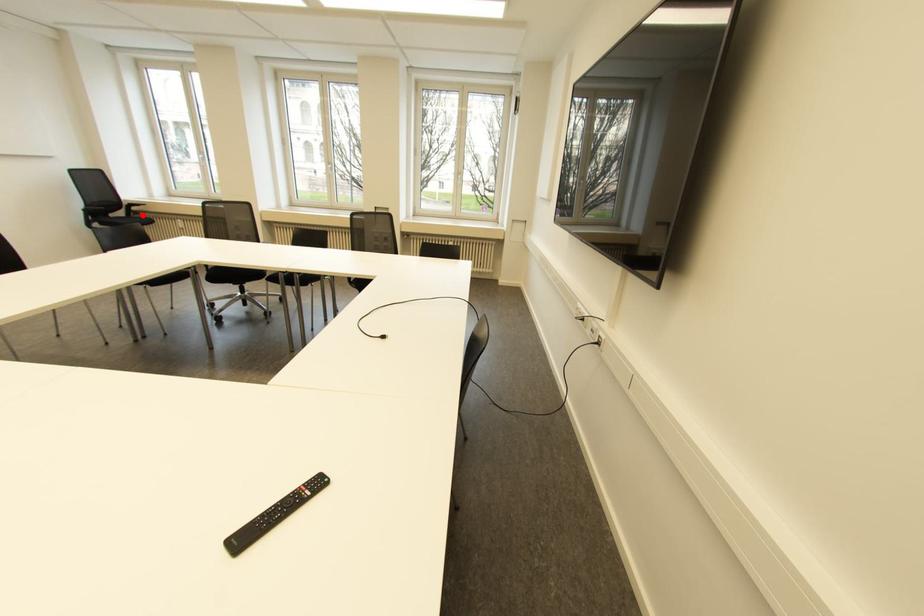
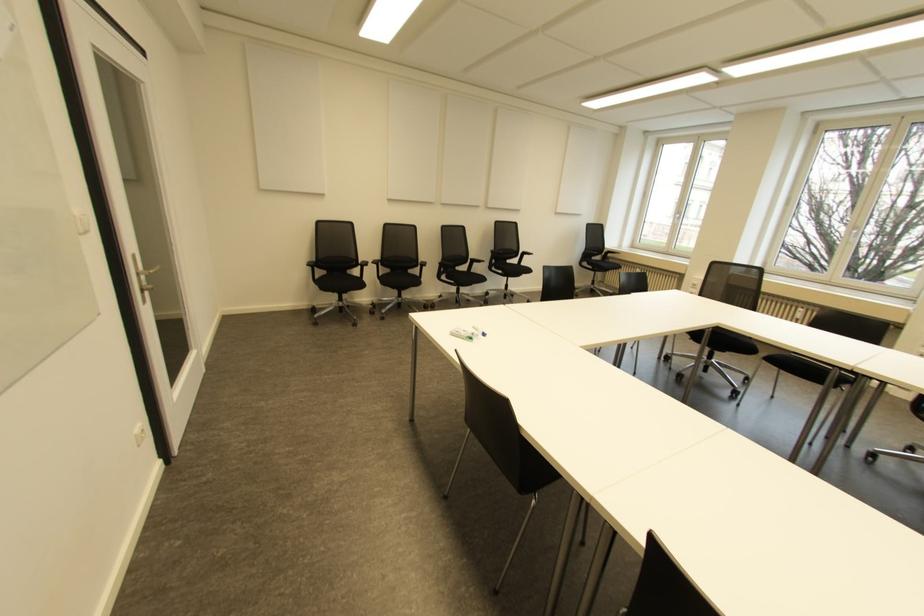
Question: I am providing you with two images of the same scene from different viewpoints. A red point is shown in image1. For the corresponding object point in image2, is it positioned nearer or farther from the camera?

Choices:
 (A) Nearer
 (B) Farther

Answer: (A)